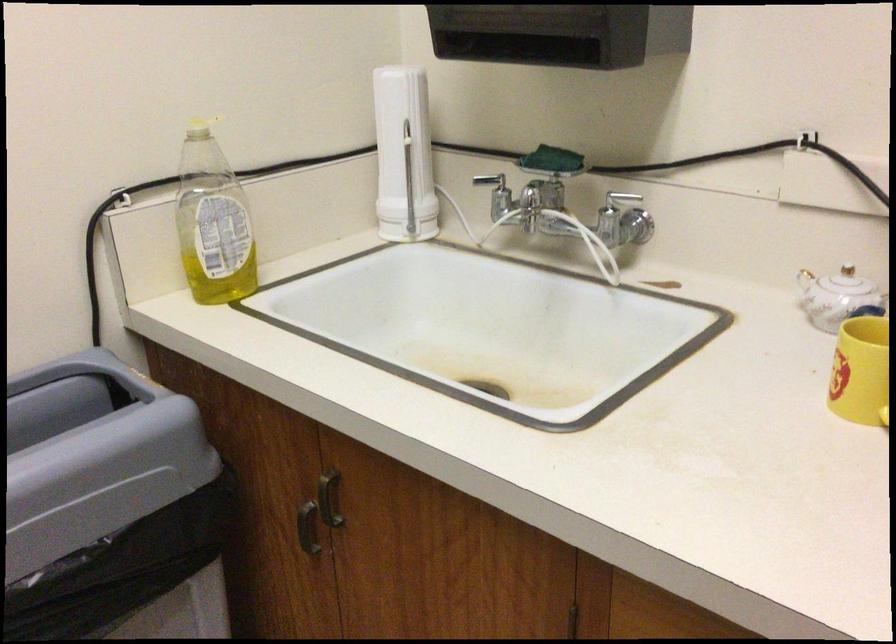
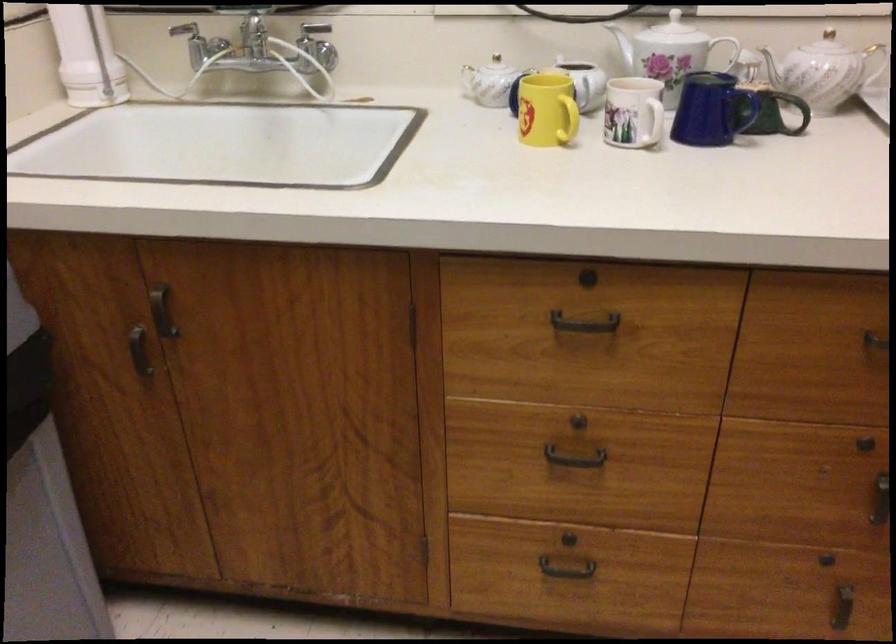
Question: The images are taken continuously from a first-person perspective. In which direction is your viewpoint rotating?

Choices:
 (A) Left
 (B) Right
 (C) Up
 (D) Down

Answer: (B)